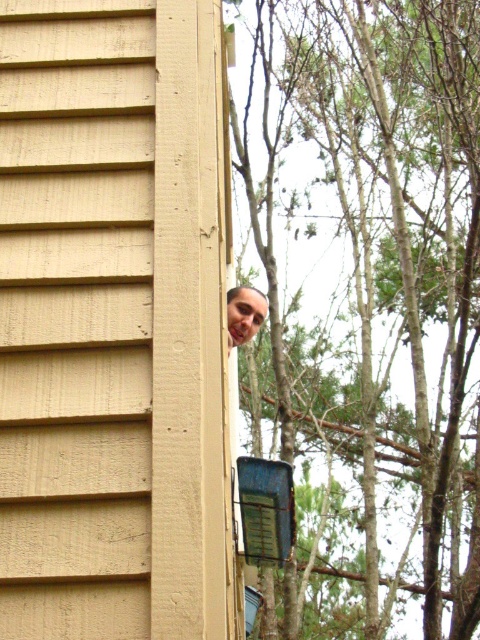
You are standing in front of the beige house siding on the left. There is a person partially visible behind the house and a green leafy tree at upper right. Based on their positions, which object is closer to the top edge of the image?

The green leafy tree at upper right is closer to the top edge of the image because its position is at point 0.800 on the y axis, which is closer to the top edge compared to the other objects.